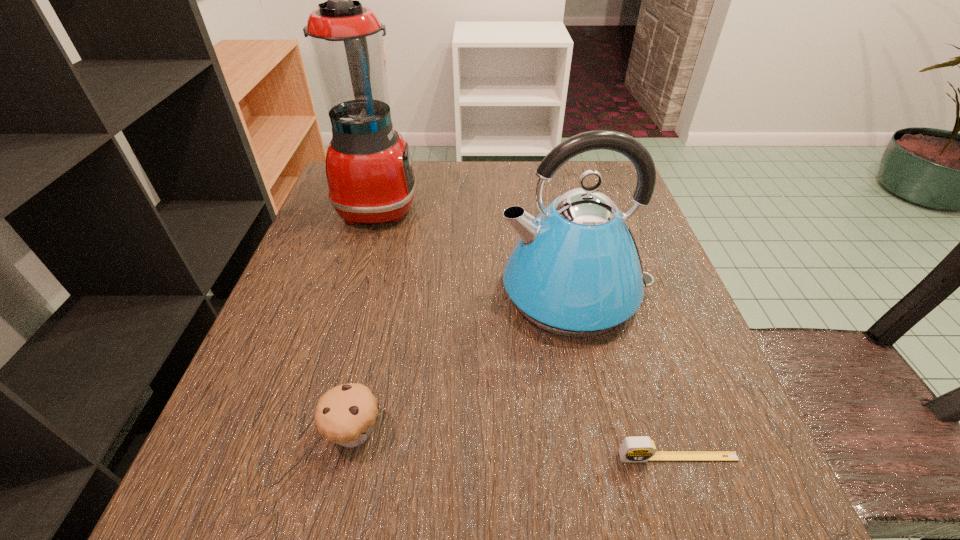
Locate an element on the screen. food processor is located at coordinates (369, 172).

Identify the location of the tallest object. The height and width of the screenshot is (540, 960). (369, 172).

Locate an element on the screen. This screenshot has width=960, height=540. kettle is located at coordinates (576, 271).

Find the location of a particular element. The height and width of the screenshot is (540, 960). the second tallest object is located at coordinates (576, 271).

Where is `muffin`? The image size is (960, 540). muffin is located at coordinates click(x=345, y=414).

The width and height of the screenshot is (960, 540). I want to click on tape measure, so click(640, 448).

The width and height of the screenshot is (960, 540). I want to click on vacant space situated 0.380m on the controls of the tallest object, so (x=583, y=205).

Locate an element on the screen. free spot located 0.160m at the spout of the second tallest object is located at coordinates (413, 292).

Identify the location of vacant space situated at the spout of the second tallest object. Image resolution: width=960 pixels, height=540 pixels. (468, 292).

Image resolution: width=960 pixels, height=540 pixels. Find the location of `vacant space situated 0.180m at the spout of the second tallest object`. vacant space situated 0.180m at the spout of the second tallest object is located at coordinates (402, 292).